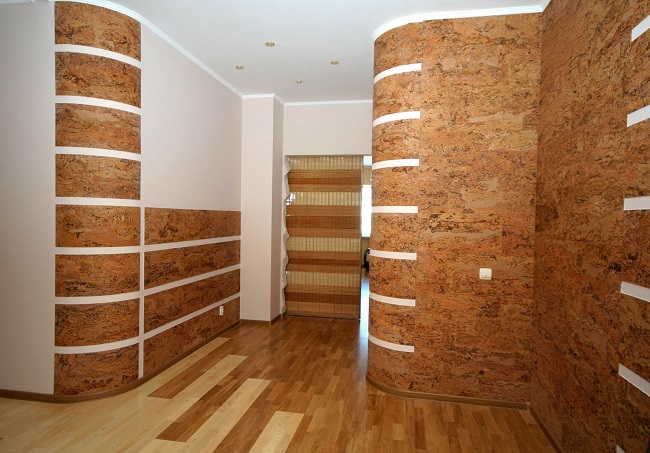
Where is `floor`? floor is located at coordinates (348, 439).